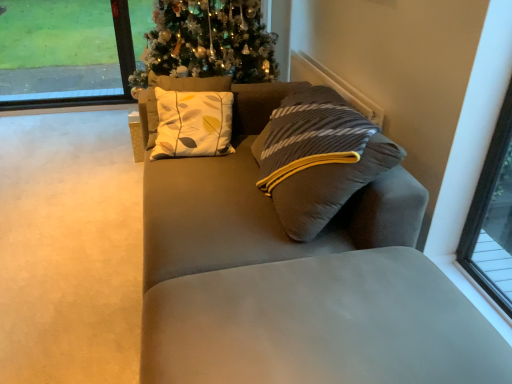
The width and height of the screenshot is (512, 384). I want to click on empty space that is ontop of beige carpet at lower left (from a real-world perspective), so click(66, 185).